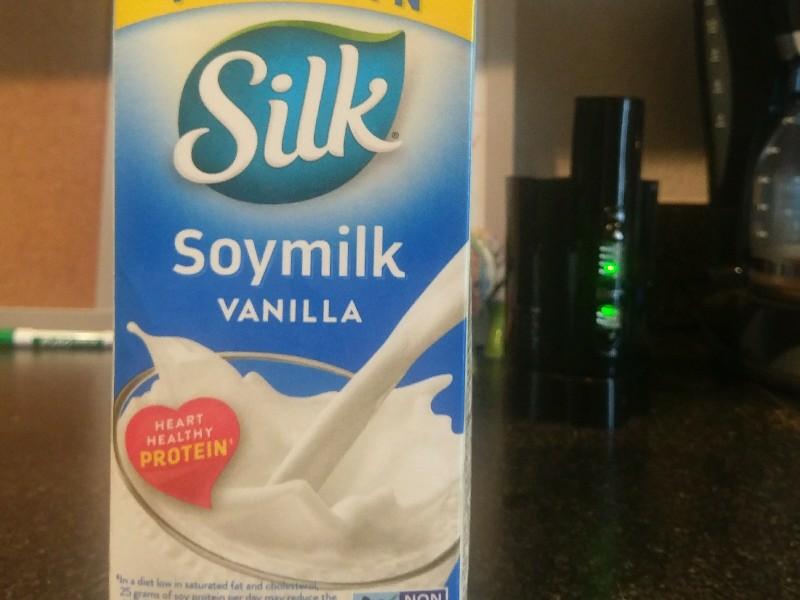
I want to click on green marker, so click(x=52, y=337).